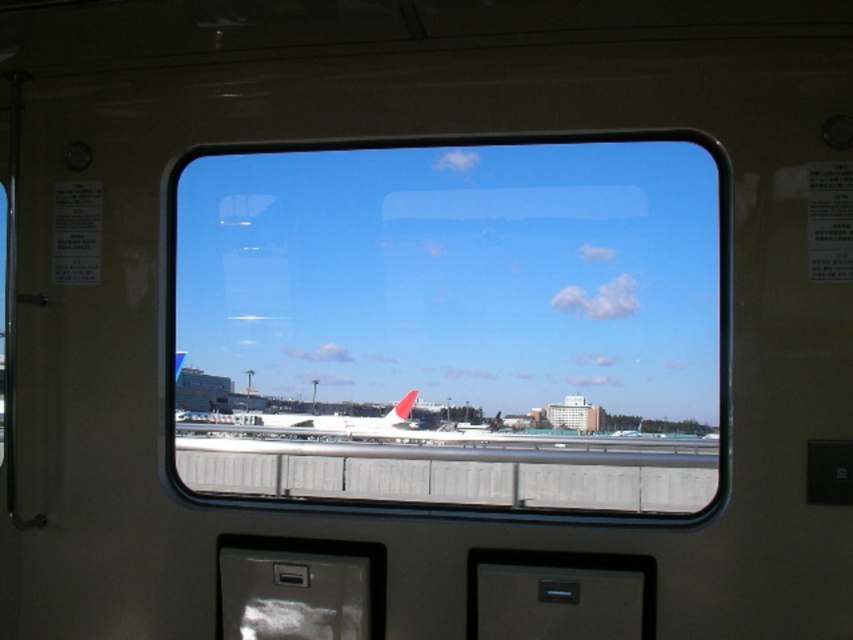
You are a GUI agent. You are given a task and a screenshot of the screen. Output one action in this format:
    pyautogui.click(x=<x>, y=<y>)
    Task: Click on the transparent glass airplane window at center
    
    Given the screenshot: What is the action you would take?
    pyautogui.click(x=456, y=323)

Is transparent glass airplane window at center to the right of white matte airplane at center from the viewer's perspective?

Indeed, transparent glass airplane window at center is positioned on the right side of white matte airplane at center.

Between point (471, 340) and point (325, 416), which one is positioned behind?

The point (325, 416) is more distant.

Identify the location of transparent glass airplane window at center. Image resolution: width=853 pixels, height=640 pixels. pos(456,323).